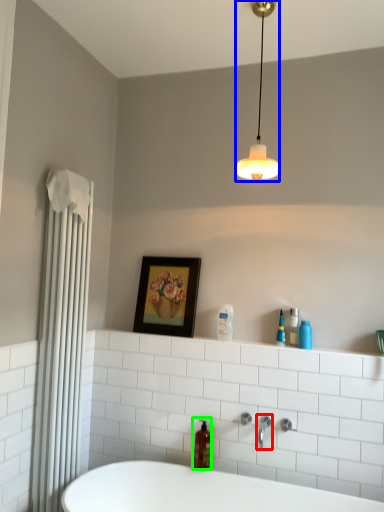
Question: Which object is the farthest from tap (highlighted by a red box)? Choose among these: lamp (highlighted by a blue box) or soap dispenser (highlighted by a green box).

Choices:
 (A) lamp
 (B) soap dispenser

Answer: (A)